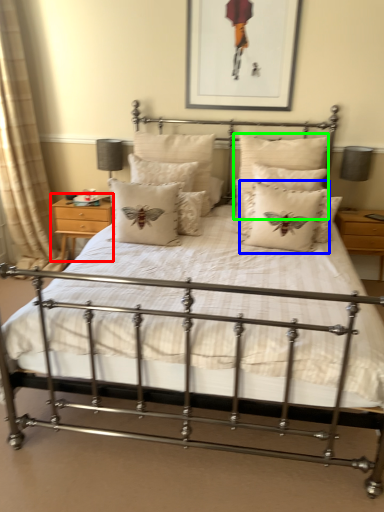
Question: Which is farther away from nightstand (highlighted by a red box)? pillow (highlighted by a blue box) or pillow (highlighted by a green box)?

Choices:
 (A) pillow
 (B) pillow

Answer: (A)